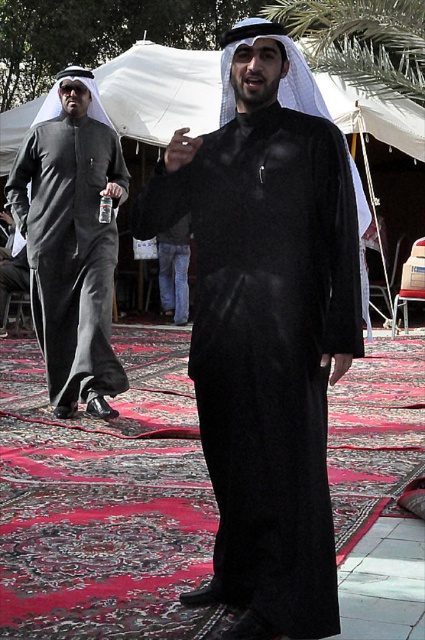
Question: Where is black matte robe at center located in relation to matte black robe at left in the image?

Choices:
 (A) above
 (B) below

Answer: (B)

Question: Is the position of black matte robe at center more distant than that of matte black robe at left?

Choices:
 (A) no
 (B) yes

Answer: (A)

Question: Which object appears closest to the camera in this image?

Choices:
 (A) black matte robe at center
 (B) matte black robe at left

Answer: (A)

Question: Is black matte robe at center wider than matte black robe at left?

Choices:
 (A) no
 (B) yes

Answer: (A)